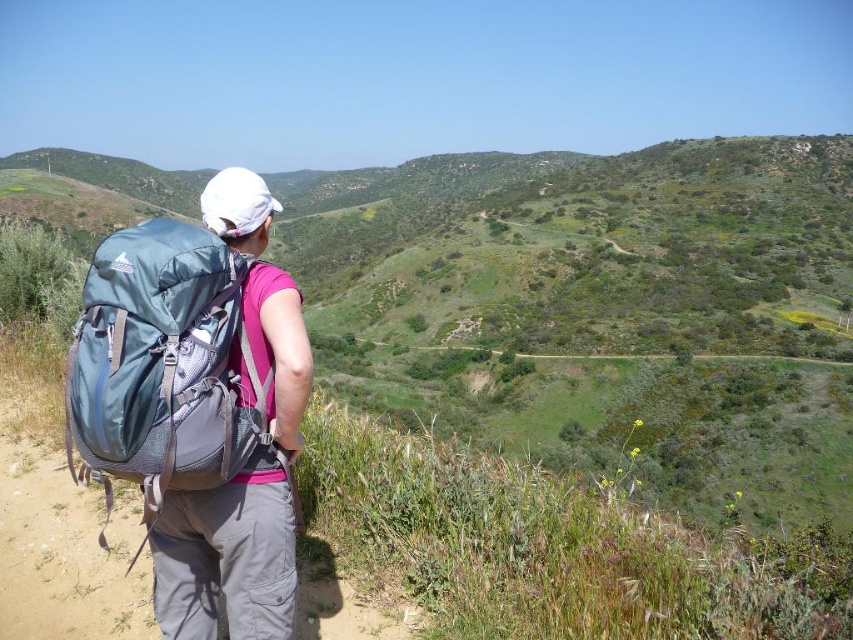
You are the hiker in the image and want to move towards the direction you are facing. Which point, point (119, 464) or point (154, 538), is closer to your current position?

Point (119, 464) is in front of point (154, 538), so it is closer to your current position as you move forward.

Based on the photo, you are a hiker planning to carry both the teal fabric backpack at left and the matte blue backpack at left. Since you can only carry one backpack, which one should you choose if you need more storage space?

The matte blue backpack at left has a larger size compared to the teal fabric backpack at left, so you should choose the matte blue backpack at left for more storage space.